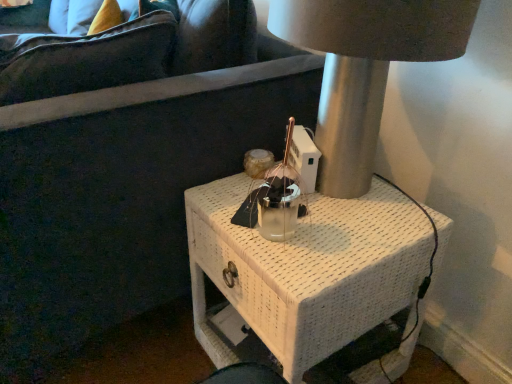
What is the approximate width of metallic silver lamp at center?

The width of metallic silver lamp at center is 15.74 inches.

Image resolution: width=512 pixels, height=384 pixels. What do you see at coordinates (365, 68) in the screenshot?
I see `metallic silver lamp at center` at bounding box center [365, 68].

Locate an element on the screen. metallic silver lamp at center is located at coordinates (365, 68).

This screenshot has height=384, width=512. Describe the element at coordinates (309, 276) in the screenshot. I see `white woven nightstand at center` at that location.

Locate an element on the screen. This screenshot has height=384, width=512. white woven nightstand at center is located at coordinates (309, 276).

Where is `metallic silver lamp at center`? This screenshot has height=384, width=512. metallic silver lamp at center is located at coordinates (x=365, y=68).

Visually, is metallic silver lamp at center positioned to the left or to the right of white woven nightstand at center?

Based on their positions, metallic silver lamp at center is located to the right of white woven nightstand at center.

Is the depth of metallic silver lamp at center greater than that of white woven nightstand at center?

No, it is in front of white woven nightstand at center.

Which is in front, point (310, 33) or point (199, 328)?

Point (310, 33)

From the picture: From the image's perspective, is metallic silver lamp at center beneath white woven nightstand at center?

Incorrect, from the image's perspective, metallic silver lamp at center is higher than white woven nightstand at center.

From a real-world perspective, between metallic silver lamp at center and white woven nightstand at center, who is vertically lower?

white woven nightstand at center is physically lower.

Considering the sizes of objects metallic silver lamp at center and white woven nightstand at center in the image provided, who is wider, metallic silver lamp at center or white woven nightstand at center?

With larger width is white woven nightstand at center.

Does metallic silver lamp at center have a lesser height compared to white woven nightstand at center?

Yes, metallic silver lamp at center is shorter than white woven nightstand at center.

Looking at the image, does metallic silver lamp at center seem bigger or smaller compared to white woven nightstand at center?

In the image, metallic silver lamp at center appears to be smaller than white woven nightstand at center.

Is metallic silver lamp at center located outside white woven nightstand at center?

Yes, metallic silver lamp at center is not within white woven nightstand at center.

Is metallic silver lamp at center far away from white woven nightstand at center?

No, metallic silver lamp at center is not far away from white woven nightstand at center.

Could you tell me if metallic silver lamp at center is turned towards white woven nightstand at center?

No.

How distant is metallic silver lamp at center from white woven nightstand at center?

They are 10.53 inches apart.

Where is `lamp on the right of white woven nightstand at center`? The height and width of the screenshot is (384, 512). lamp on the right of white woven nightstand at center is located at coordinates (365, 68).

Considering the positions of objects white woven nightstand at center and metallic silver lamp at center in the image provided, who is more to the right, white woven nightstand at center or metallic silver lamp at center?

metallic silver lamp at center is more to the right.

Is the depth of white woven nightstand at center greater than that of metallic silver lamp at center?

Yes, the depth of white woven nightstand at center is greater than that of metallic silver lamp at center.

Considering the points (325, 247) and (413, 31), which point is in front, point (325, 247) or point (413, 31)?

The point (413, 31) is in front.

From the image's perspective, which one is positioned lower, white woven nightstand at center or metallic silver lamp at center?

From the image's view, white woven nightstand at center is below.

From a real-world perspective, is white woven nightstand at center above or below metallic silver lamp at center?

Clearly, from a real-world perspective, white woven nightstand at center is below metallic silver lamp at center.

Which of these two, white woven nightstand at center or metallic silver lamp at center, is wider?

Wider between the two is white woven nightstand at center.

Who is shorter, white woven nightstand at center or metallic silver lamp at center?

metallic silver lamp at center is shorter.

Can you confirm if white woven nightstand at center is smaller than metallic silver lamp at center?

No.

Choose the correct answer: Is white woven nightstand at center inside metallic silver lamp at center or outside it?

white woven nightstand at center cannot be found inside metallic silver lamp at center.

Are white woven nightstand at center and metallic silver lamp at center located far from each other?

white woven nightstand at center is near metallic silver lamp at center, not far away.

Is white woven nightstand at center aimed at metallic silver lamp at center?

No, white woven nightstand at center is not oriented towards metallic silver lamp at center.

What's the angular difference between white woven nightstand at center and metallic silver lamp at center's facing directions?

They differ by 1.13 degrees in their facing directions.

Find the location of a particular element. This screenshot has width=512, height=384. nightstand below the metallic silver lamp at center (from a real-world perspective) is located at coordinates (309, 276).

Where is `lamp on the right of white woven nightstand at center`? lamp on the right of white woven nightstand at center is located at coordinates (365, 68).

Where is `lamp located in front of the white woven nightstand at center`? lamp located in front of the white woven nightstand at center is located at coordinates (365, 68).